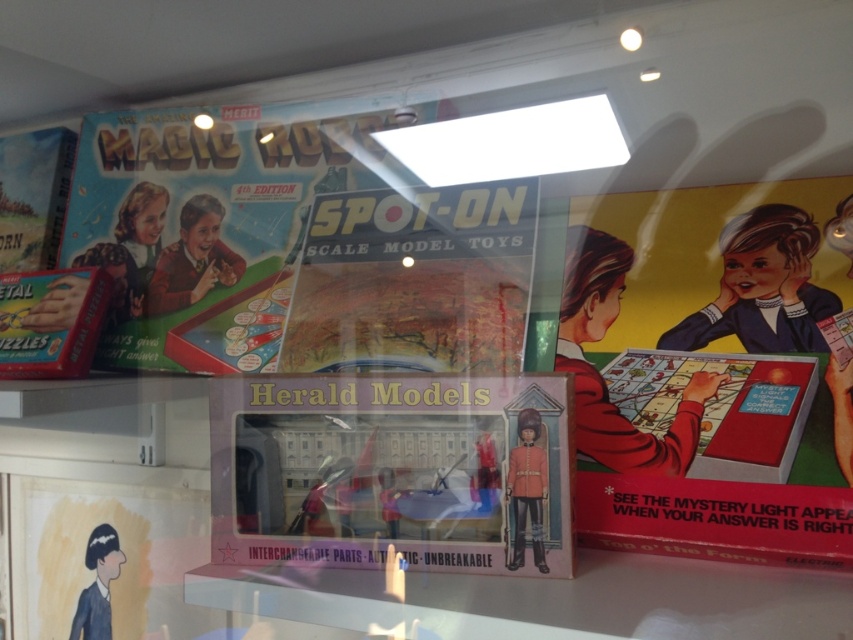
Does metallic puzzles at left have a greater height compared to matte red uniform at center?

No, metallic puzzles at left is not taller than matte red uniform at center.

Where is `metallic puzzles at left`? This screenshot has height=640, width=853. metallic puzzles at left is located at coordinates (50, 323).

Where is `matte cardboard game at upper left`? matte cardboard game at upper left is located at coordinates (210, 221).

Does matte cardboard game at upper left have a larger size compared to matte red board game at center?

Correct, matte cardboard game at upper left is larger in size than matte red board game at center.

Does point (248, 147) come behind point (621, 408)?

Yes, it is.

Where is `matte cardboard game at upper left`? matte cardboard game at upper left is located at coordinates (210, 221).

Which of these two, matte red board game at center or matte black toy soldier at lower left, stands taller?

matte black toy soldier at lower left

Which is behind, point (659, 353) or point (78, 620)?

The point (78, 620) is behind.

The image size is (853, 640). Identify the location of matte red board game at center. (721, 406).

Where is `matte red board game at center`? matte red board game at center is located at coordinates (721, 406).